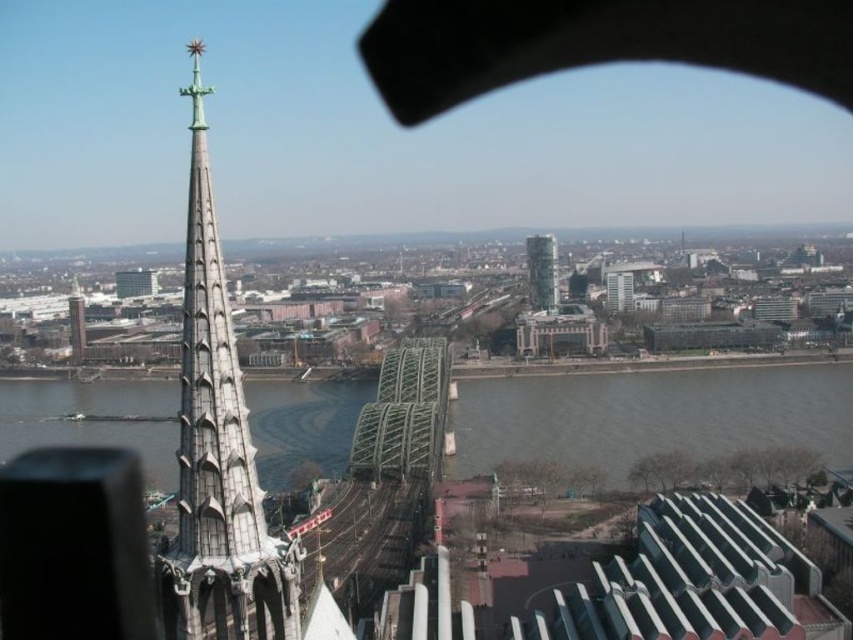
Question: Which point appears farthest from the camera in this image?

Choices:
 (A) (525, 412)
 (B) (548, 243)

Answer: (B)

Question: Can you confirm if gray metallic water at center is smaller than glassy reflective tower at center?

Choices:
 (A) yes
 (B) no

Answer: (B)

Question: Is gray metallic water at center in front of matte gray tower at left?

Choices:
 (A) no
 (B) yes

Answer: (B)

Question: Which object is the farthest from the white stone spire at left?

Choices:
 (A) gray metallic water at center
 (B) matte gray tower at left
 (C) glassy reflective tower at center

Answer: (C)

Question: Does glassy reflective tower at center appear on the left side of matte gray tower at left?

Choices:
 (A) yes
 (B) no

Answer: (B)

Question: Which point appears closest to the camera in this image?

Choices:
 (A) (546, 268)
 (B) (73, 317)
 (C) (689, 428)

Answer: (C)